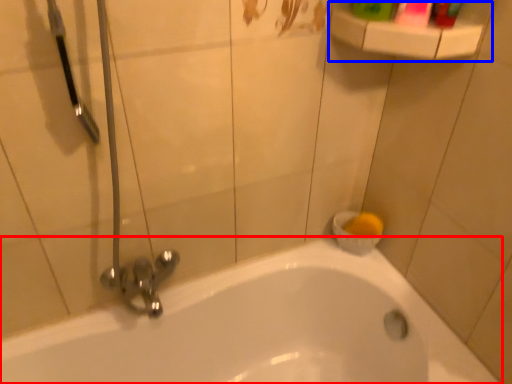
Question: Among these objects, which one is farthest to the camera, bathtub (highlighted by a red box) or balustrade (highlighted by a blue box)?

Choices:
 (A) bathtub
 (B) balustrade

Answer: (B)